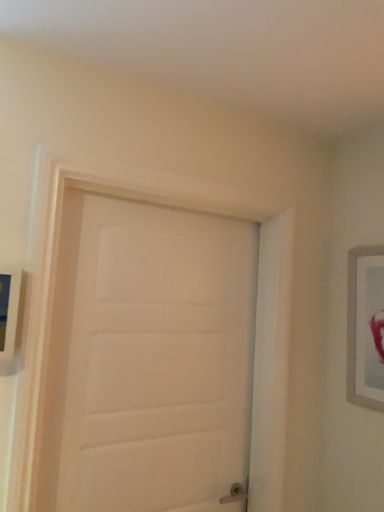
Question: Is white matte door at center to the left or to the right of wooden picture frame at left, the 1th picture frame from the front, in the image?

Choices:
 (A) right
 (B) left

Answer: (A)

Question: Considering their positions, is white matte door at center located in front of or behind wooden picture frame at left, the 1th picture frame from the front?

Choices:
 (A) behind
 (B) front

Answer: (A)

Question: Which is farther from the silver metallic picture frame at right, which appears as the second picture frame when viewed from the left?

Choices:
 (A) white matte door at center
 (B) wooden picture frame at left, arranged as the 2th picture frame when viewed from the back

Answer: (B)

Question: Estimate the real-world distances between objects in this image. Which object is closer to the wooden picture frame at left, arranged as the 2th picture frame when viewed from the back?

Choices:
 (A) silver metallic picture frame at right, which appears as the first picture frame when viewed from the right
 (B) white matte door at center

Answer: (B)